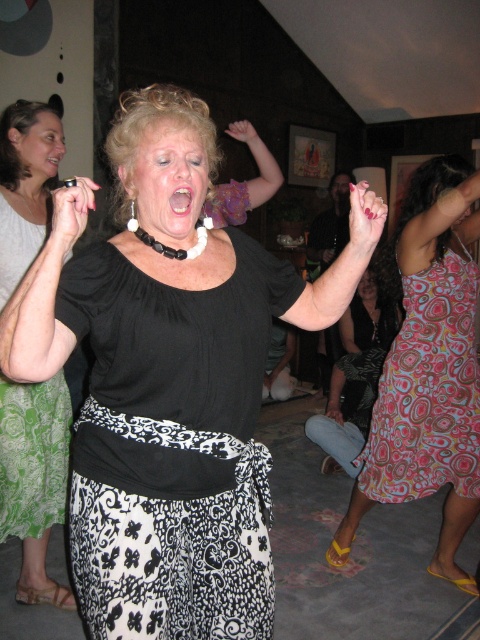
From the picture: You are at a party and want to find the tallest person wearing either the multicolored patterned dress at right or the black matte dress at center. Which one should you look for?

The multicolored patterned dress at right is much taller than the black matte dress at center, so you should look for the person wearing the multicolored patterned dress at right.